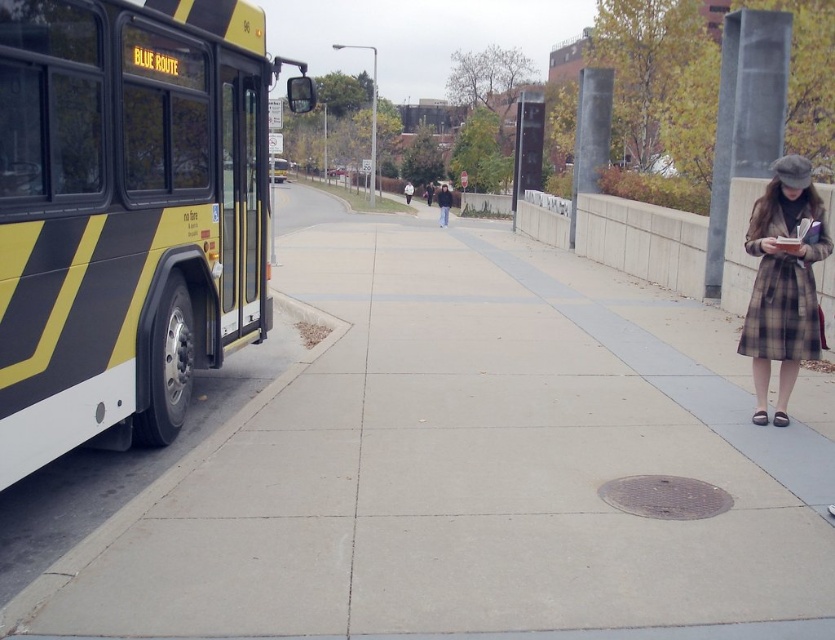
Question: Is plaid wool coat at right further to the viewer compared to plaid wool coat at center?

Choices:
 (A) yes
 (B) no

Answer: (B)

Question: Among these objects, which one is farthest from the camera?

Choices:
 (A) plaid wool coat at center
 (B) plaid wool coat at right
 (C) yellow and black painted bus at left
 (D) dark gray coat at center

Answer: (A)

Question: Which point is closer to the camera?

Choices:
 (A) (19, 38)
 (B) (782, 186)
 (C) (444, 224)
 (D) (411, 230)

Answer: (A)

Question: Can you confirm if dark gray coat at center is wider than plaid wool coat at center?

Choices:
 (A) no
 (B) yes

Answer: (A)

Question: Can you confirm if plaid wool coat at right is positioned to the right of plaid wool coat at center?

Choices:
 (A) no
 (B) yes

Answer: (B)

Question: Which point is farther to the camera?

Choices:
 (A) plaid wool coat at right
 (B) dark gray coat at center
 (C) plaid wool coat at center
 (D) yellow and black painted bus at left

Answer: (C)